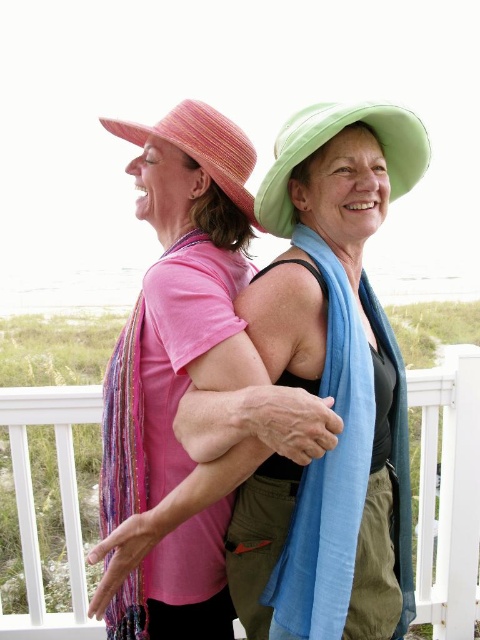
You are a delivery robot with a 3.5 feet wide package. You need to navigate between the matte green hat at center and the white wooden railing at center. Can you fit through the space between them?

The distance between the matte green hat at center and the white wooden railing at center is 5.46 feet, which is wider than the 3.5 feet wide package. Therefore, the delivery robot can fit through the space between them.

You are standing on the porch and want to place a small potted plant between the two people so that it is exactly halfway between them. Given that the coordinates of the green hat at center are point (331, 387), can you determine the coordinates of the other person to calculate the midpoint?

The coordinates of the green hat at center are point (331, 387). To find the midpoint between the two people, you need the coordinates of both individuals. Since only the coordinates of the green hat at center are provided, you cannot determine the exact coordinates of the other person to calculate the midpoint.

You are organizing a fashion show and need to decide which accessory to feature first. The blue silk scarf at center and the green fabric hat at upper center are both candidates. Based on their sizes, which one should be showcased first if you prioritize larger accessories?

The blue silk scarf at center should be showcased first because it is larger in size than the green fabric hat at upper center.